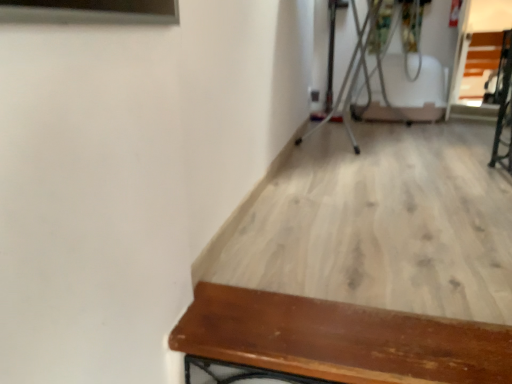
In order to face shiny brown wood bench at lower left, should I rotate leftwards or rightwards?

To align with it, rotate right about 11.517°.

The width and height of the screenshot is (512, 384). Identify the location of shiny brown wood bench at lower left. (339, 339).

The height and width of the screenshot is (384, 512). What do you see at coordinates (339, 339) in the screenshot?
I see `shiny brown wood bench at lower left` at bounding box center [339, 339].

Where is `shiny brown wood bench at lower left`? shiny brown wood bench at lower left is located at coordinates (339, 339).